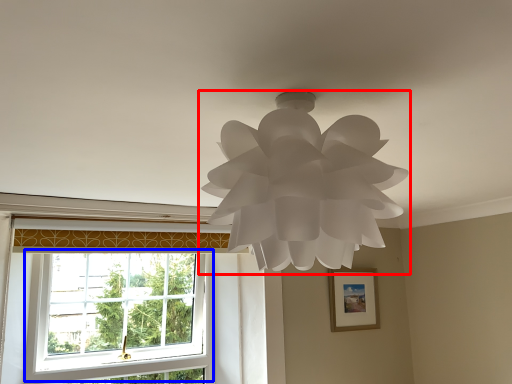
Question: Which of the following is the closest to the observer, lamp (highlighted by a red box) or window (highlighted by a blue box)?

Choices:
 (A) lamp
 (B) window

Answer: (A)